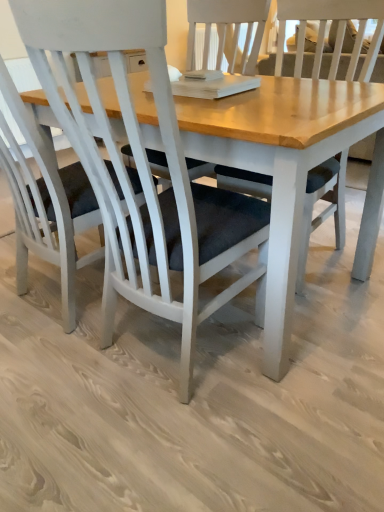
Find the location of a particular element. The image size is (384, 512). free space in front of white matte chair at center, which is counted as the 1th chair, starting from the right is located at coordinates (184, 451).